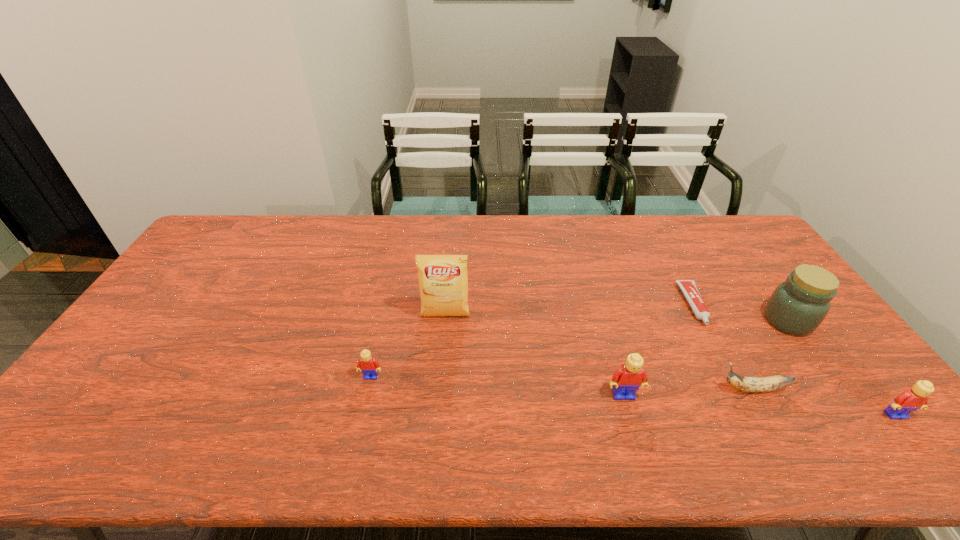
The height and width of the screenshot is (540, 960). In order to click on banana in this screenshot , I will do `click(745, 384)`.

At what (x,y) coordinates should I click in order to perform the action: click on vacant space located on the front-facing side of the leftmost object. Please return your answer as a coordinate pair (x, y). Looking at the image, I should click on (362, 418).

Locate an element on the screen. vacant space located at the nozzle of the toothpaste is located at coordinates (715, 346).

Where is `free space located on the front of the crisp (potato chip) with the logo`? The height and width of the screenshot is (540, 960). free space located on the front of the crisp (potato chip) with the logo is located at coordinates (440, 382).

Identify the location of vacant space located on the left of the jar. This screenshot has height=540, width=960. (642, 321).

Locate an element on the screen. This screenshot has width=960, height=540. vacant space located 0.390m on the peel of the banana is located at coordinates (564, 389).

At what (x,y) coordinates should I click in order to perform the action: click on vacant space located on the peel of the banana. Please return your answer as a coordinate pair (x, y). Image resolution: width=960 pixels, height=540 pixels. Looking at the image, I should click on (639, 389).

Identify the location of free space located 0.220m on the peel of the banana. (632, 389).

Where is `banana that is at the near edge`? Image resolution: width=960 pixels, height=540 pixels. banana that is at the near edge is located at coordinates (745, 384).

Locate an element on the screen. Image resolution: width=960 pixels, height=540 pixels. Lego present at the right edge is located at coordinates (910, 400).